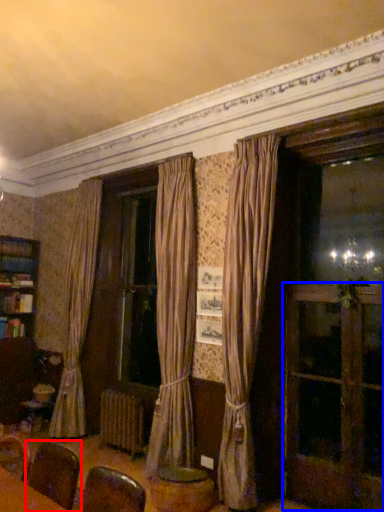
Question: Which object appears farthest to the camera in this image, armchair (highlighted by a red box) or screen door (highlighted by a blue box)?

Choices:
 (A) armchair
 (B) screen door

Answer: (B)